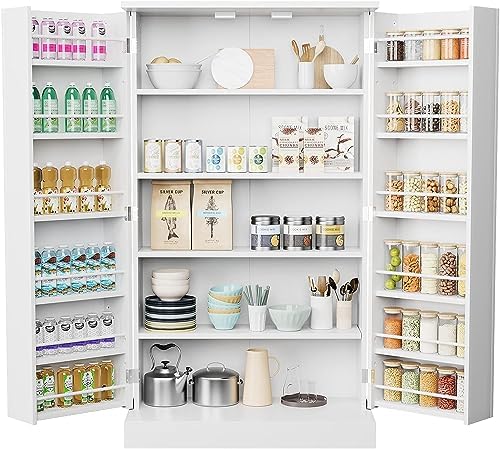
Locate an element on the screen. The height and width of the screenshot is (449, 500). glass jars on the third shelf is located at coordinates (465, 178), (450, 180), (431, 180), (409, 180), (395, 180).